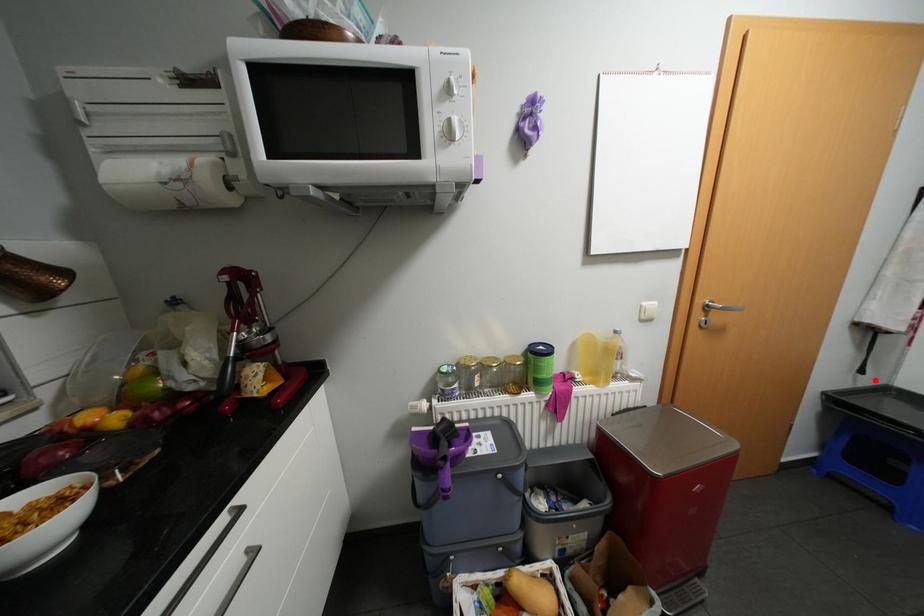
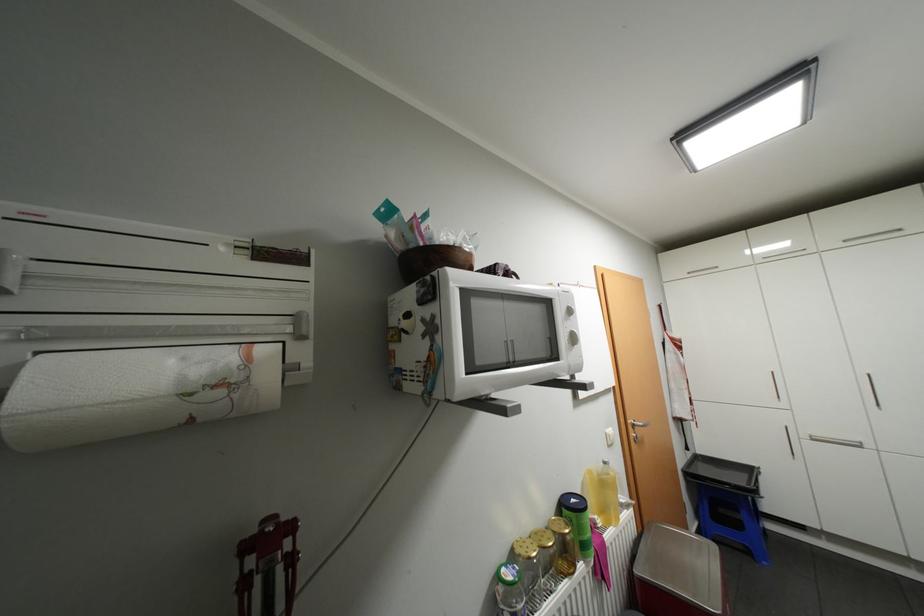
In the second image, find the point that corresponds to the highlighted location in the first image.

(697, 453)